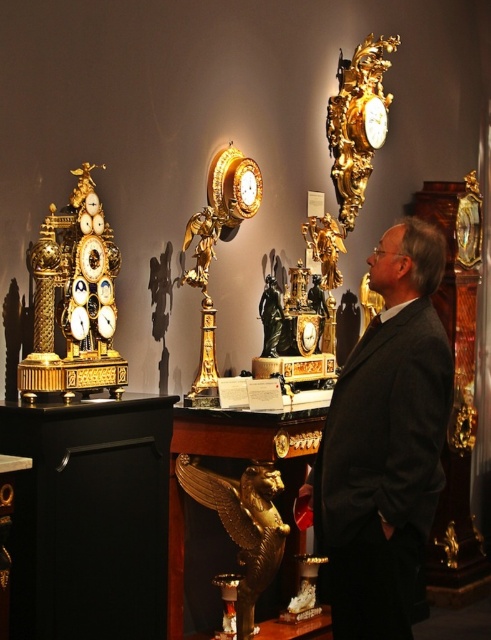
You are standing in front of the antique clock display. You notice a black suit at center. Which object is located at the coordinates point (385, 442)?

The black suit at center is located at point (385, 442).